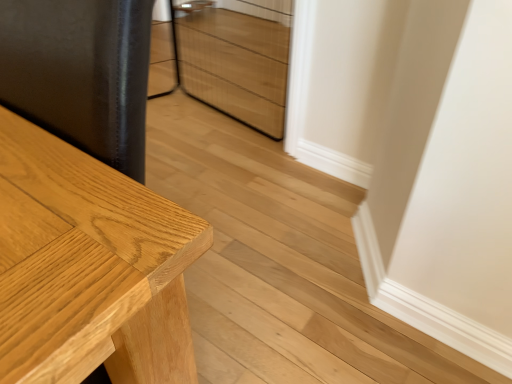
Question: Considering their positions, is light brown wood table at left located in front of or behind wooden drawer at center?

Choices:
 (A) front
 (B) behind

Answer: (A)

Question: From the image's perspective, is light brown wood table at left positioned above or below wooden drawer at center?

Choices:
 (A) above
 (B) below

Answer: (B)

Question: Is light brown wood table at left taller or shorter than wooden drawer at center?

Choices:
 (A) tall
 (B) short

Answer: (A)

Question: Is point (238, 94) positioned closer to the camera than point (185, 309)?

Choices:
 (A) farther
 (B) closer

Answer: (A)

Question: Based on their positions, is wooden drawer at center located to the left or right of light brown wood table at left?

Choices:
 (A) right
 (B) left

Answer: (A)

Question: From the image's perspective, relative to light brown wood table at left, is wooden drawer at center above or below?

Choices:
 (A) above
 (B) below

Answer: (A)

Question: Would you say wooden drawer at center is inside or outside light brown wood table at left?

Choices:
 (A) inside
 (B) outside

Answer: (B)